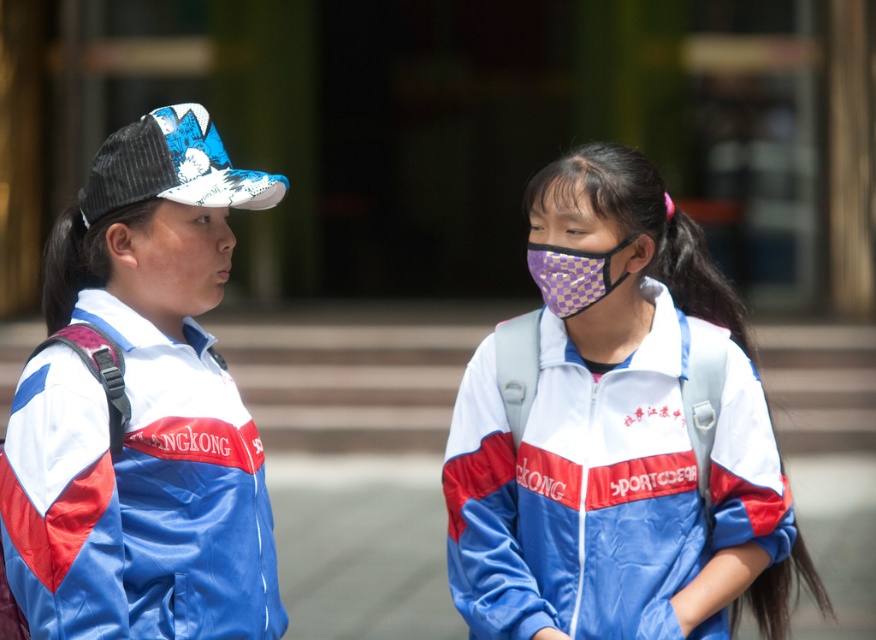
Question: Does matte blue jacket at left have a greater width compared to purple checkered mask at center?

Choices:
 (A) no
 (B) yes

Answer: (B)

Question: Can you confirm if purple checkered fabric mask at center is positioned to the right of purple checkered mask at center?

Choices:
 (A) no
 (B) yes

Answer: (B)

Question: Which of these objects is positioned closest to the purple checkered fabric mask at center?

Choices:
 (A) matte blue jacket at left
 (B) purple checkered mask at center

Answer: (B)

Question: Among these points, which one is farthest from the camera?

Choices:
 (A) (76, 372)
 (B) (583, 212)

Answer: (B)

Question: Which object is closer to the camera taking this photo?

Choices:
 (A) purple checkered fabric mask at center
 (B) matte blue jacket at left

Answer: (B)

Question: From the image, what is the correct spatial relationship of purple checkered fabric mask at center in relation to purple checkered mask at center?

Choices:
 (A) above
 (B) below

Answer: (B)